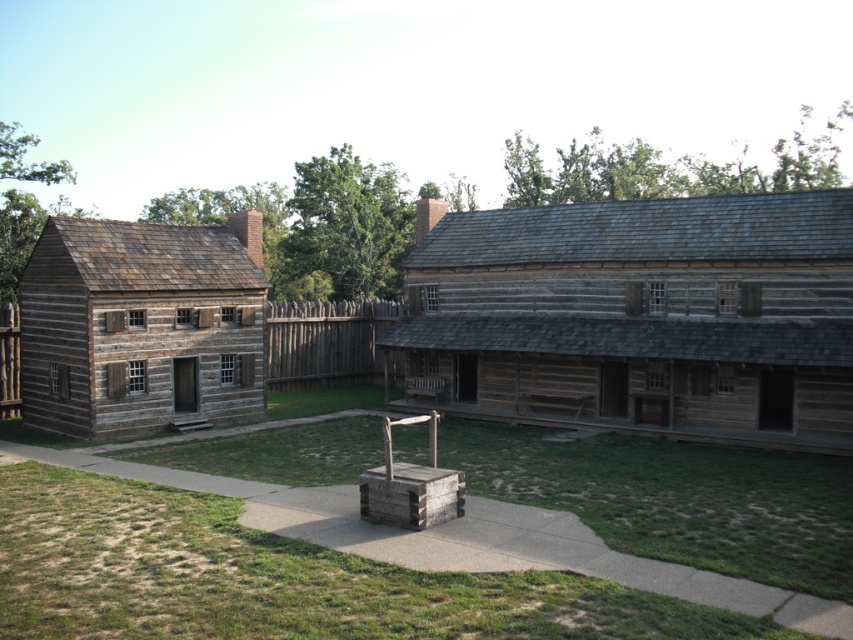
You are a visitor at this historical site and want to draw a map showing the wooden well at center and the weathered brown wood log cabin at center. Based on the scene, which object should be drawn to the left of the other?

The wooden well at center should be drawn to the left of the weathered brown wood log cabin at center because it is positioned on the left side of it.

You are a visitor at this historical site and want to take a photo of the wooden well at center and the weathered brown wood log cabin at center. Which object should you focus on first if you want to capture both in a single frame without moving the camera?

The wooden well at center is shorter than the weathered brown wood log cabin at center, so you should focus on the weathered brown wood log cabin at center first to ensure it is fully in frame.